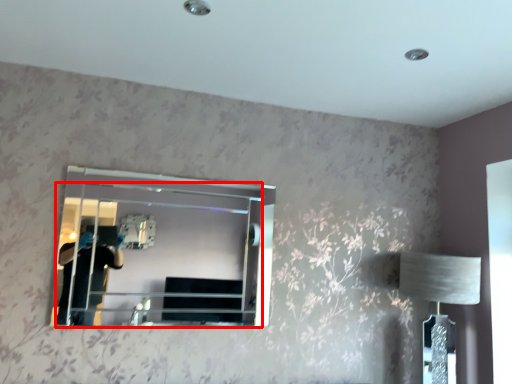
Question: From the image's perspective, what is the correct spatial relationship of mirror (annotated by the red box) in relation to table lamp?

Choices:
 (A) above
 (B) below

Answer: (A)